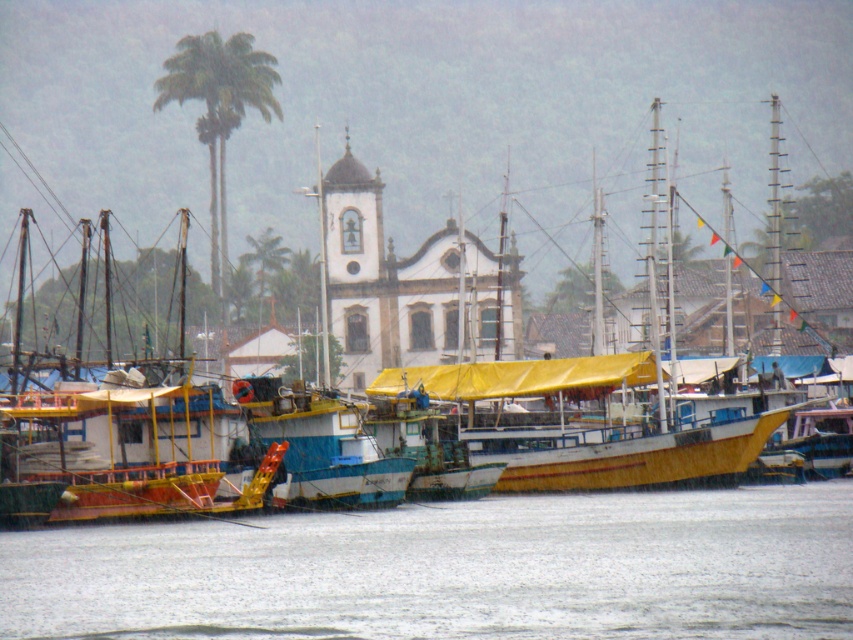
Based on the photo, you are standing at the point marked as point (x=454, y=570) in the lower center of the image. Looking around, you see the white church with a dome and arched windows in the background and several brightly colored boats docked along the shore. What is located at your current position?

The transparent water at lower center is located at point (x=454, y=570), so you are standing in the transparent water at lower center.

You are standing at the point closest to the edge of the water in this waterfront scene. You want to walk directly towards the church in the background. Which of the two points, point [827,596] or point [236,51], would you pass first?

You would first pass point [236,51] because it is closer to your starting position at the water edge. Since you are moving towards the church, point [827,596] is behind point [236,51] in this direction.

You are a tourist standing on the shore looking at the transparent water at lower center and the green leafy palm tree at upper left. Which object appears larger in the image?

The green leafy palm tree at upper left appears larger than the transparent water at lower center.